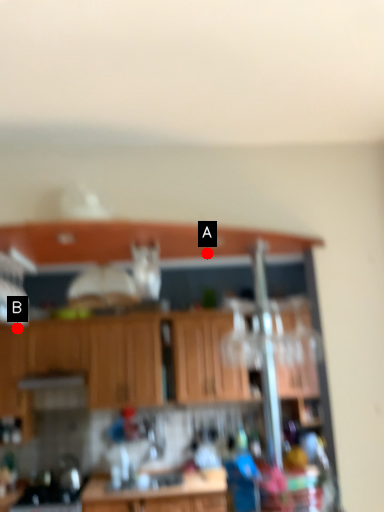
Question: Two points are circled on the image, labeled by A and B beside each circle. Which point appears farthest from the camera in this image?

Choices:
 (A) A is further
 (B) B is further

Answer: (B)